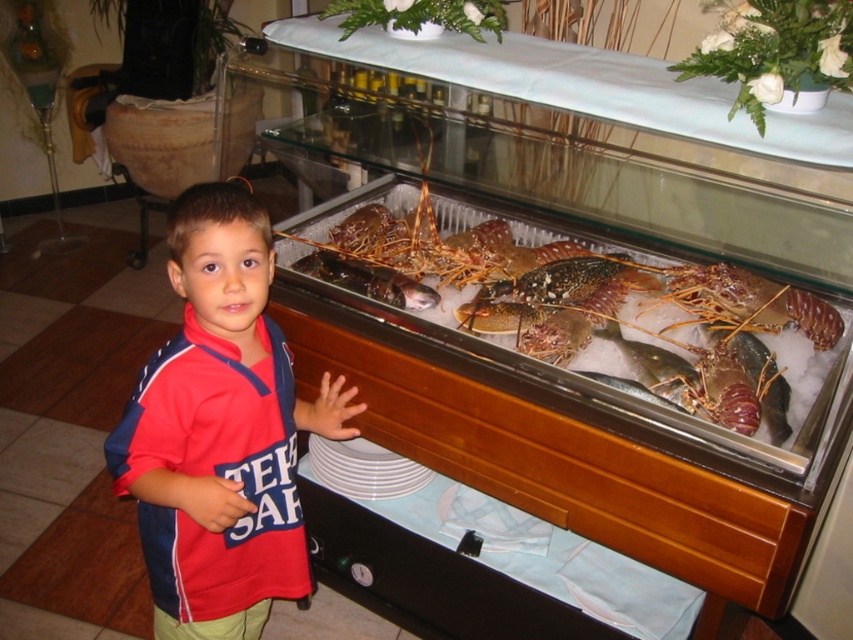
You are a customer at the seafood market and want to point out the shiny brown lobster at center and the shiny silver fish at center to the vendor. Which one is on the left side when looking at the display case?

The shiny brown lobster at center is to the left of the shiny silver fish at center, so the shiny brown lobster at center is on the left side when looking at the display case.

What is located at the point with coordinates (219, 432)?

The red cotton shirt at center is located at point (219, 432).